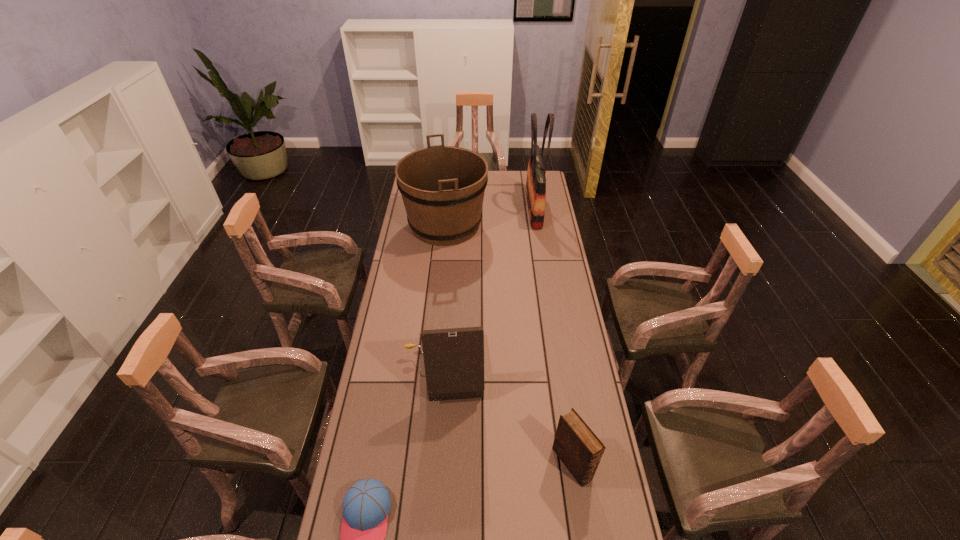
This screenshot has width=960, height=540. I want to click on vacant space situated 0.340m on the left of the Bible, so click(446, 464).

The width and height of the screenshot is (960, 540). I want to click on object that is at the far edge, so click(x=536, y=181).

I want to click on bucket at the left edge, so click(x=442, y=187).

You are a GUI agent. You are given a task and a screenshot of the screen. Output one action in this format:
    pyautogui.click(x=<x>, y=<y>)
    Task: Click on the phonograph record situated at the left edge
    This screenshot has width=960, height=540.
    Given the screenshot: What is the action you would take?
    pyautogui.click(x=453, y=358)

The height and width of the screenshot is (540, 960). I want to click on shopping bag at the right edge, so click(x=536, y=181).

At what (x,y) coordinates should I click in order to perform the action: click on Bible positioned at the right edge. Please return your answer as a coordinate pair (x, y). This screenshot has width=960, height=540. Looking at the image, I should click on click(580, 450).

The height and width of the screenshot is (540, 960). I want to click on object that is at the far right corner, so click(x=536, y=181).

The image size is (960, 540). What are the coordinates of `vacant space at the left edge` in the screenshot? It's located at (406, 278).

The image size is (960, 540). I want to click on vacant space at the right edge of the desktop, so click(x=541, y=289).

I want to click on vacant area that lies between the Bible and the second tallest object, so click(x=509, y=344).